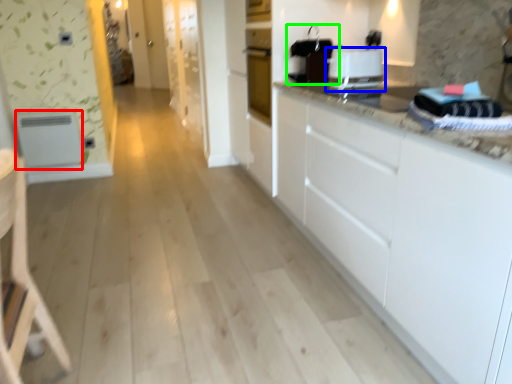
Question: Estimate the real-world distances between objects in this image. Which object is farther from appliance (highlighted by a red box), home appliance (highlighted by a blue box) or appliance (highlighted by a green box)?

Choices:
 (A) home appliance
 (B) appliance

Answer: (A)